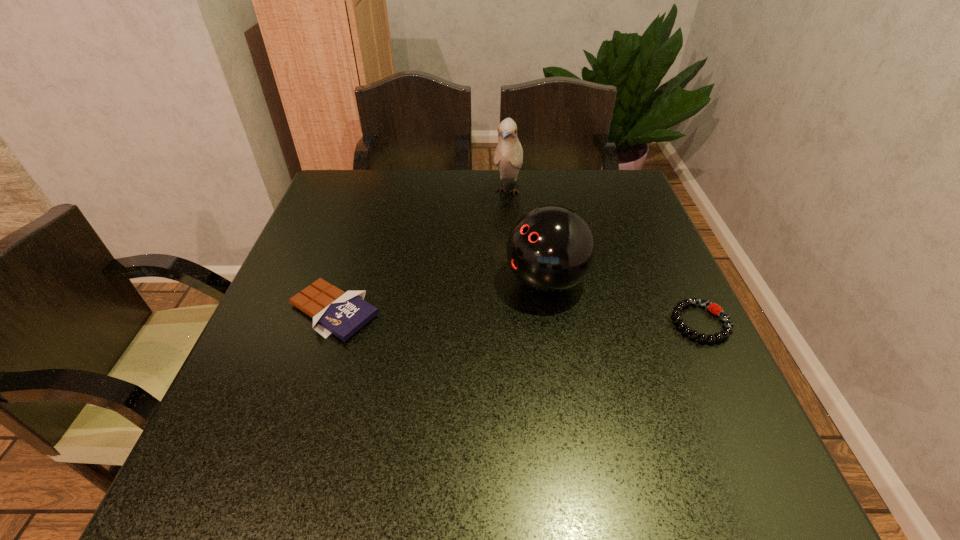
Identify the location of empty space that is in between the third tallest object and the bowling ball. This screenshot has height=540, width=960. (441, 296).

I want to click on free space between the chocolate bar and the farthest object, so click(x=420, y=251).

Where is `vacant space that's between the leftmost object and the bird`? This screenshot has width=960, height=540. vacant space that's between the leftmost object and the bird is located at coordinates (420, 251).

The height and width of the screenshot is (540, 960). I want to click on object that is the second closest to the tallest object, so click(333, 311).

Find the location of a particular element. the third closest object to the bowling ball is located at coordinates (333, 311).

Find the location of `vacant area in the image that satisfies the following two spatial constraints: 1. on the front side of the rightmost object; 2. on the right side of the chocolate bar`. vacant area in the image that satisfies the following two spatial constraints: 1. on the front side of the rightmost object; 2. on the right side of the chocolate bar is located at coordinates (330, 322).

The width and height of the screenshot is (960, 540). Identify the location of vacant region that satisfies the following two spatial constraints: 1. on the back side of the leftmost object; 2. on the left side of the bird. (373, 191).

You are a GUI agent. You are given a task and a screenshot of the screen. Output one action in this format:
    pyautogui.click(x=<x>, y=<y>)
    Task: Click on the free space that satisfies the following two spatial constraints: 1. on the front side of the farthest object; 2. on the left side of the bowling ball
    
    Given the screenshot: What is the action you would take?
    pyautogui.click(x=515, y=281)